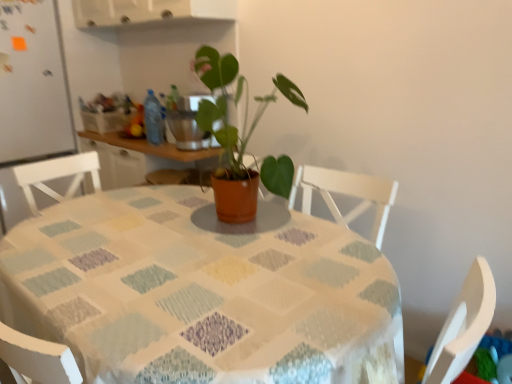
I want to click on free spot in front of matte terracotta pot at center, so click(232, 249).